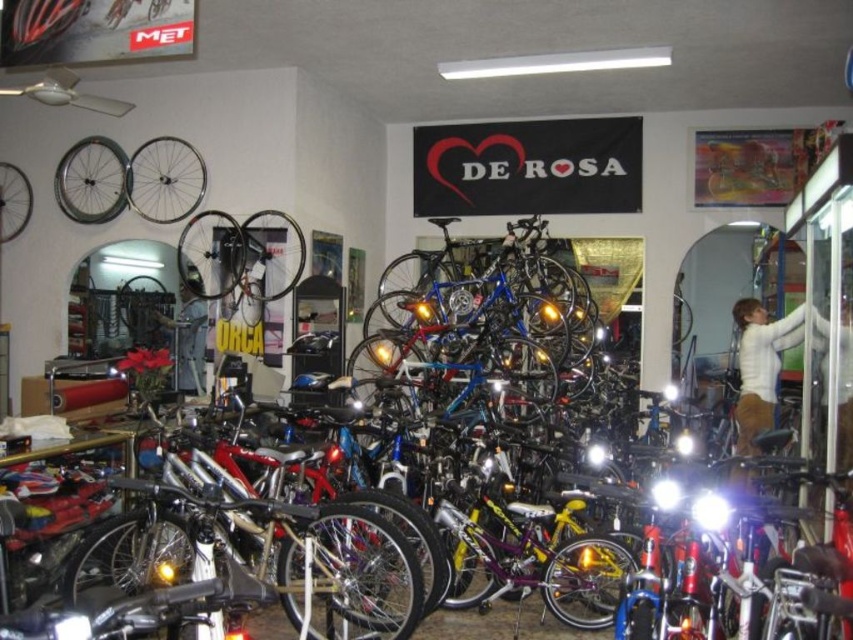
Question: Among these objects, which one is farthest from the camera?

Choices:
 (A) white matte shirt at right
 (B) denim jacket at center

Answer: (B)

Question: Is white matte shirt at right below denim jacket at center?

Choices:
 (A) yes
 (B) no

Answer: (A)

Question: Is shiny silver wheel at upper left to the left of white matte shirt at right from the viewer's perspective?

Choices:
 (A) no
 (B) yes

Answer: (B)

Question: Considering the real-world distances, which object is farthest from the denim jacket at center?

Choices:
 (A) shiny silver wheel at upper left
 (B) white matte shirt at right

Answer: (B)

Question: Which point appears farthest from the camera in this image?

Choices:
 (A) (183, 330)
 (B) (190, 177)

Answer: (A)

Question: Is shiny silver wheel at upper left positioned at the back of denim jacket at center?

Choices:
 (A) no
 (B) yes

Answer: (A)